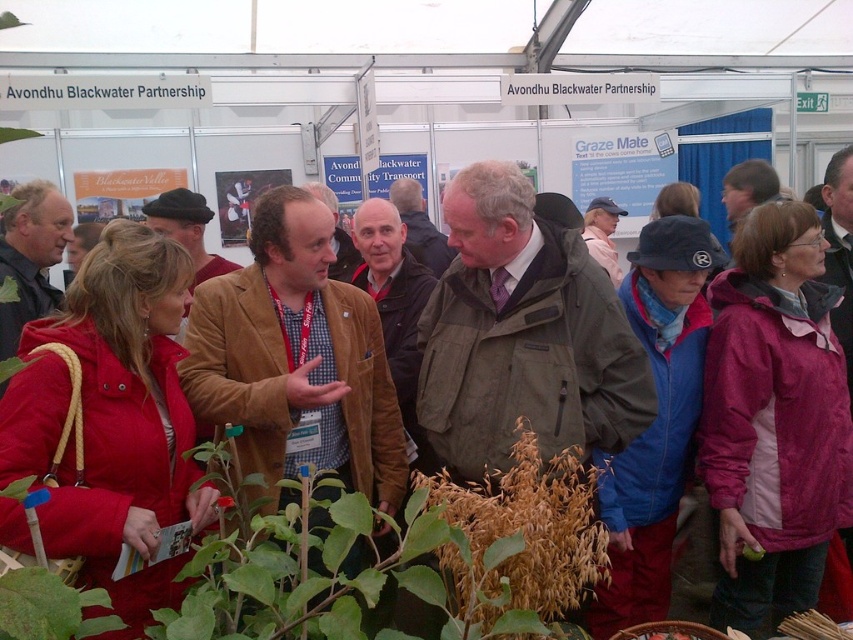
Question: Which object appears closest to the camera in this image?

Choices:
 (A) matte red jacket at lower left
 (B) brown textured plant at center
 (C) green leafy plant at lower left

Answer: (C)

Question: Can you confirm if matte red jacket at lower left is smaller than brown textured plant at center?

Choices:
 (A) yes
 (B) no

Answer: (B)

Question: Among these objects, which one is nearest to the camera?

Choices:
 (A) green leafy plant at lower left
 (B) matte red jacket at lower left

Answer: (A)

Question: Among these points, which one is farthest from the camera?

Choices:
 (A) (88, 566)
 (B) (74, 588)

Answer: (A)

Question: Is matte red jacket at lower left behind green leafy plant at lower left?

Choices:
 (A) no
 (B) yes

Answer: (B)

Question: Is pink fabric jacket at lower right further to camera compared to green leafy plant at lower left?

Choices:
 (A) no
 (B) yes

Answer: (B)